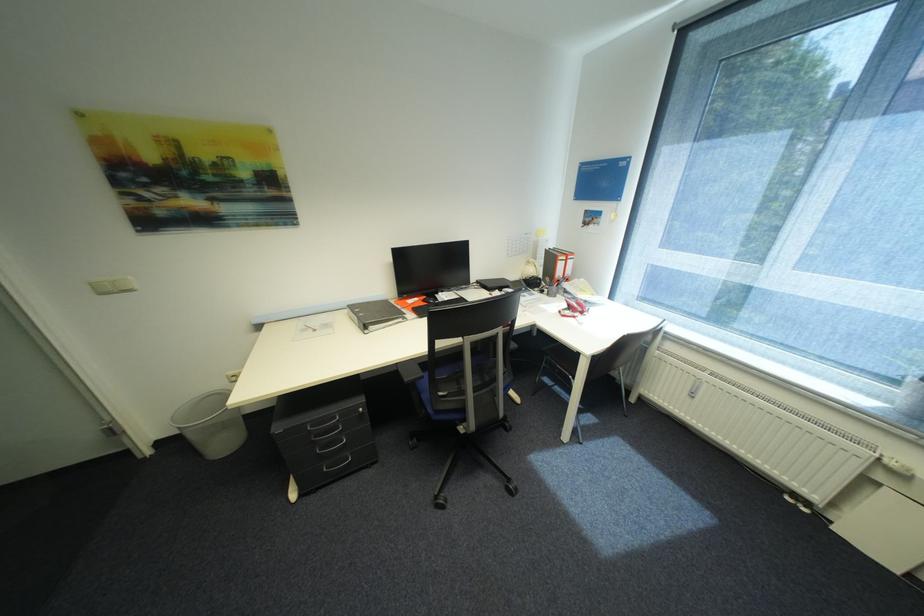
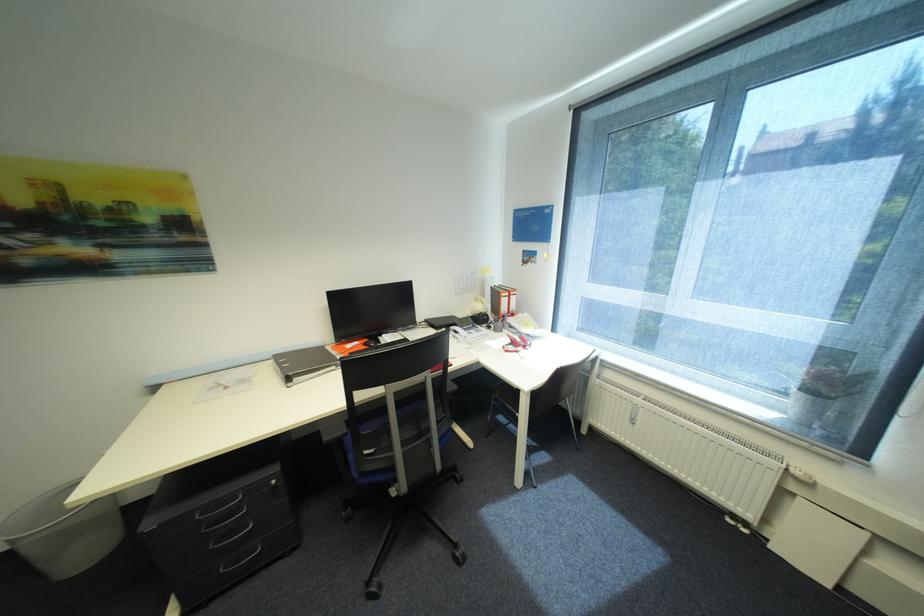
In the second image, find the point that corresponds to point (695, 392) in the first image.

(636, 419)